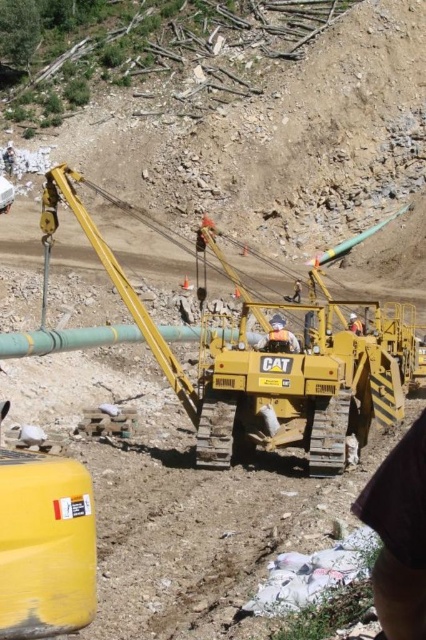
Which is behind, point (118, 332) or point (276, 348)?

The point (118, 332) is behind.

Does green matte pipe at center have a larger size compared to white fabric construction worker at center?

Correct, green matte pipe at center is larger in size than white fabric construction worker at center.

Find the location of `green matte pipe at center`. green matte pipe at center is located at coordinates (65, 339).